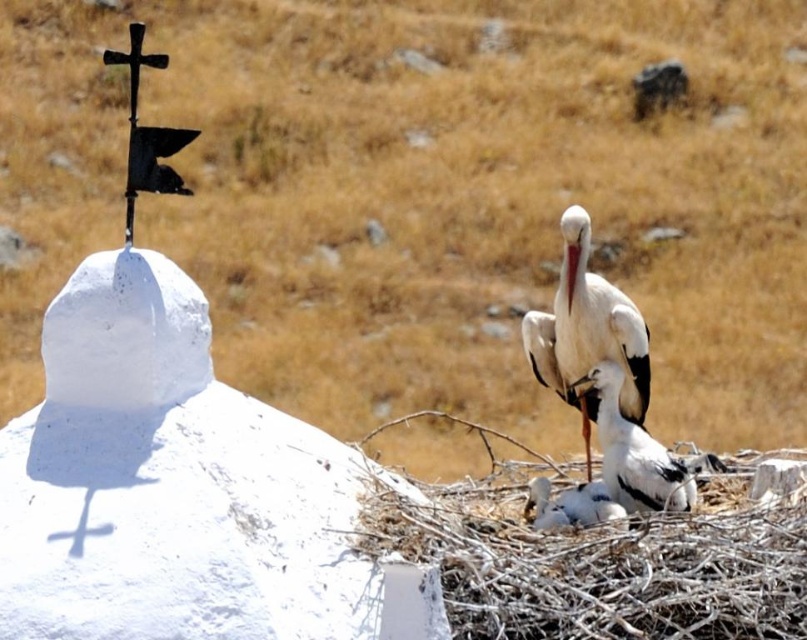
You are standing at the origin point of the coordinate system in this image. The white matte stork at center is located at point (587, 332). If you want to move towards the white matte stork at center, which direction should you move in terms of the coordinate system?

The white matte stork at center is located at point (587, 332). In a standard coordinate system, the x and y values increase to the right and downward respectively. Therefore, to move towards the white matte stork at center from the origin, you should move to the right and downward.

From the picture: You are standing at the origin of the coordinate system in the image. You see two points labeled as point [583,339] and point [592,374]. Which point is closer to you?

Point [592,374] is closer to you because it is in front of point [583,339].